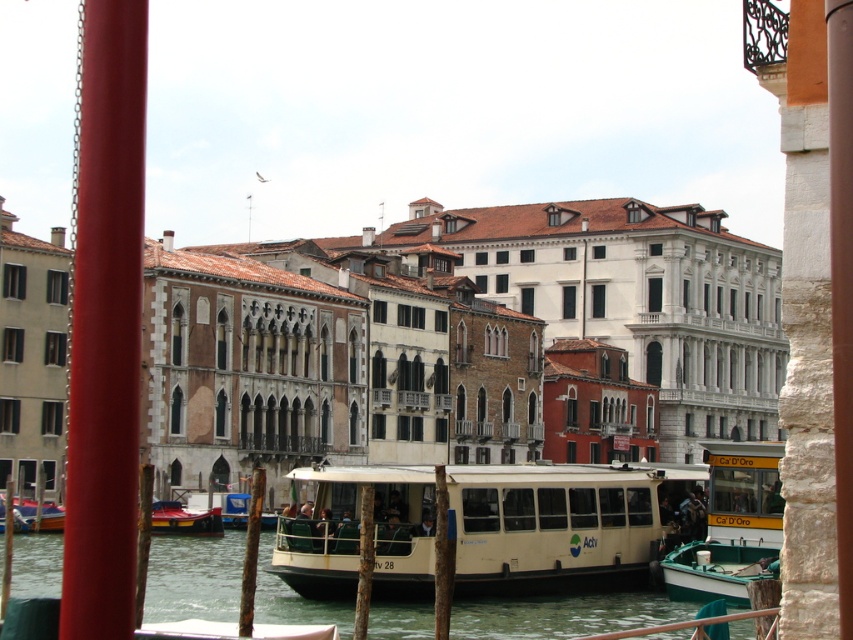
You are planning to take a boat tour in Venice and have to choose between the beige rubber boat at center and the metallic red boat at lower left. Based on their sizes, which one can accommodate more passengers?

The beige rubber boat at center is bigger than the metallic red boat at lower left, so it can accommodate more passengers.

Consider the image. You are a tourist in Venice and want to take a photo of the beige rubber boat at center from the ACTV water taxi. Since the ACTV is docked at the pier, can you take the photo without moving from your current position?

The beige rubber boat at center is located at point (477, 529), which is within the visible area from the ACTV water taxi. Therefore, you can take the photo without moving from your current position.

You are a tourist planning to rent a boat for a short trip along the canal. You see the beige rubber boat at center and the metallic red boat at lower left. Which boat is wider?

The beige rubber boat at center is wider than the metallic red boat at lower left because its width surpasses the latter.